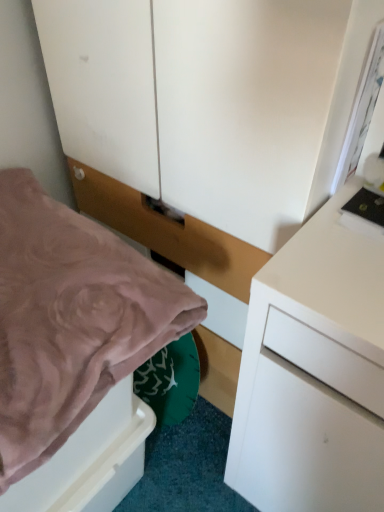
Identify the location of velvet pink blanket at left. (70, 320).

This screenshot has width=384, height=512. Describe the element at coordinates (70, 320) in the screenshot. I see `velvet pink blanket at left` at that location.

What is the approximate width of velvet pink blanket at left?

55.63 centimeters.

You are a GUI agent. You are given a task and a screenshot of the screen. Output one action in this format:
    pyautogui.click(x=<x>, y=<y>)
    Task: Click on the velvet pink blanket at left
    
    Given the screenshot: What is the action you would take?
    pyautogui.click(x=70, y=320)